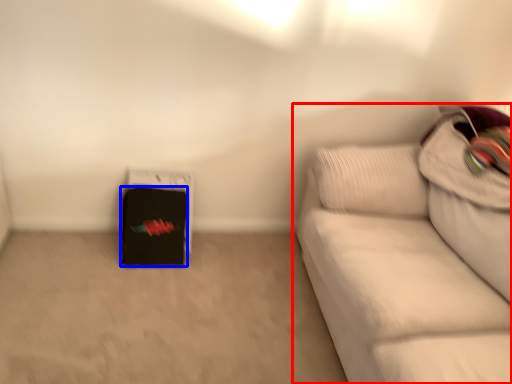
Question: Which object appears farthest to the camera in this image, studio couch (highlighted by a red box) or luggage (highlighted by a blue box)?

Choices:
 (A) studio couch
 (B) luggage

Answer: (B)